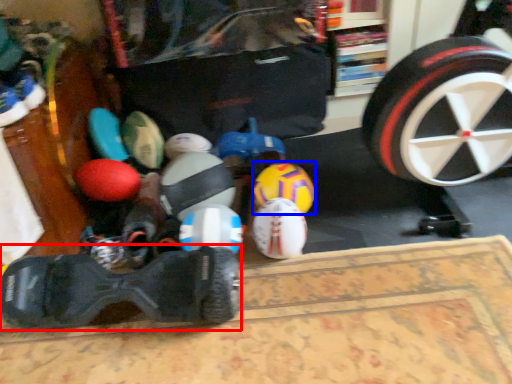
Question: Among these objects, which one is farthest to the camera, footwear (highlighted by a red box) or toy (highlighted by a blue box)?

Choices:
 (A) footwear
 (B) toy

Answer: (B)